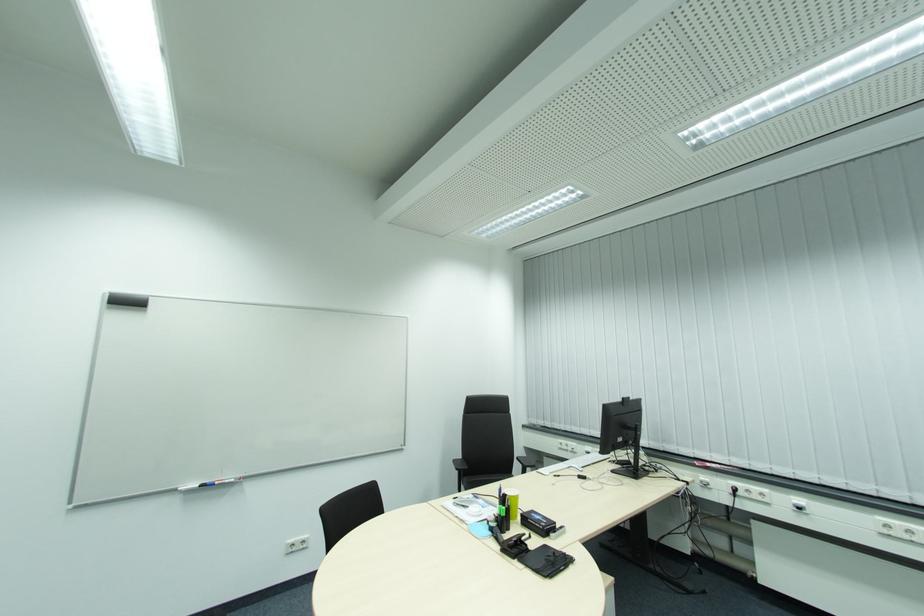
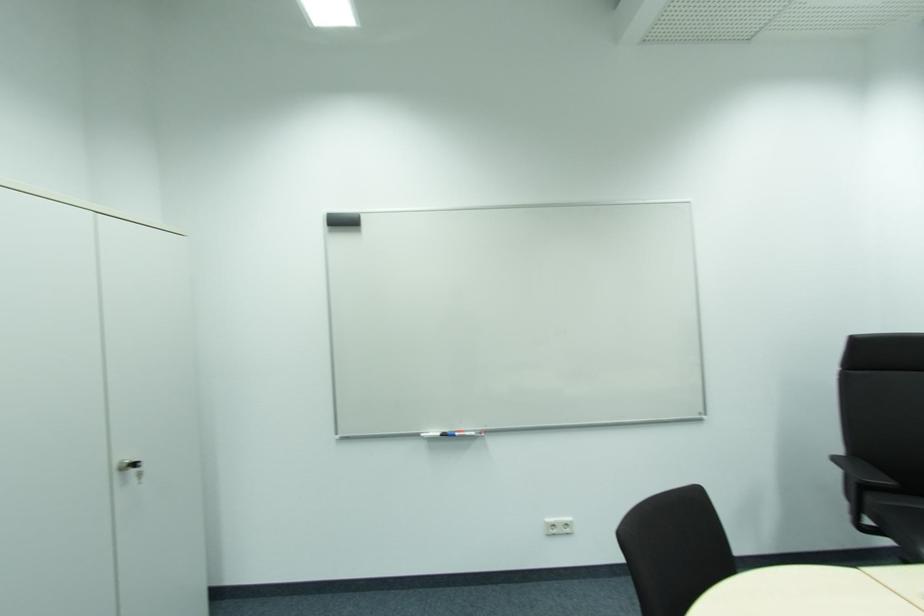
Locate, in the second image, the point that corresponds to point (460, 461) in the first image.

(842, 459)